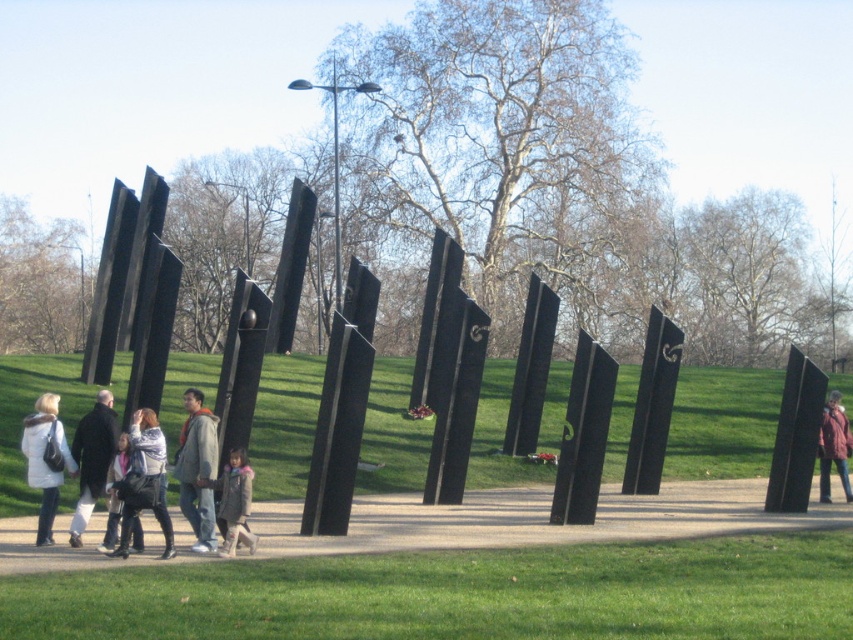
Can you confirm if light gray sweater at center is smaller than dark gray coat at center?

Yes.

Is point (131, 509) positioned in front of point (105, 401)?

Yes, it is in front of point (105, 401).

The height and width of the screenshot is (640, 853). Identify the location of light gray sweater at center. (143, 481).

Which of these two, light brown wool coat at center or matte red jacket at center, stands shorter?

Standing shorter between the two is light brown wool coat at center.

Find the location of a particular element. Image resolution: width=853 pixels, height=640 pixels. light brown wool coat at center is located at coordinates (235, 502).

Is polished black pillars at center below light gray sweater at center?

Incorrect, polished black pillars at center is not positioned below light gray sweater at center.

Who is more distant from viewer, (x=305, y=604) or (x=131, y=449)?

The point (x=131, y=449) is behind.

Where is `polished black pillars at center`? polished black pillars at center is located at coordinates (461, 595).